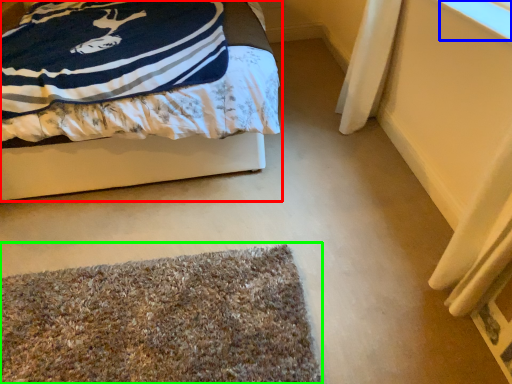
Question: Considering the real-world distances, which object is closest to bed (highlighted by a red box)? window screen (highlighted by a blue box) or mat (highlighted by a green box).

Choices:
 (A) window screen
 (B) mat

Answer: (B)